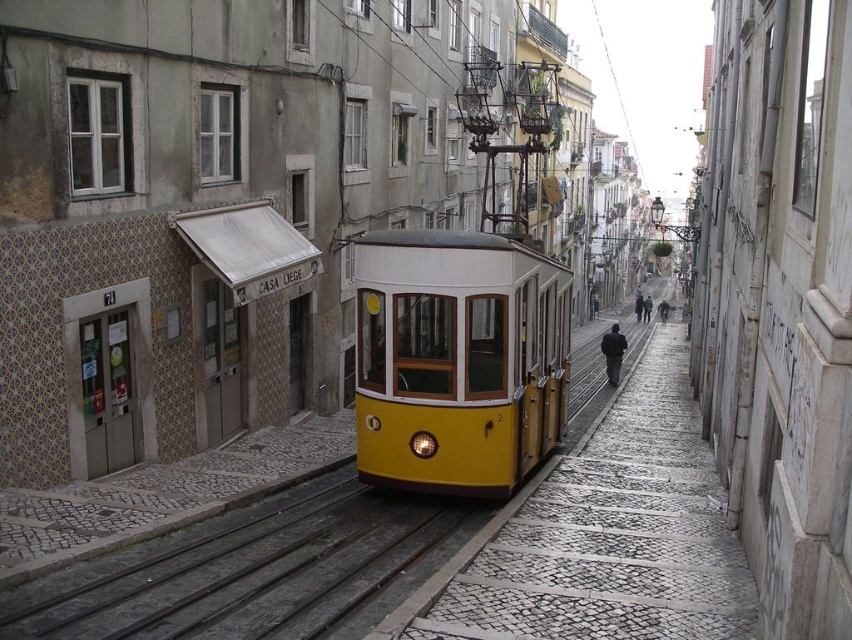
You are standing on the street and want to take a photo of the yellow matte cable car at center and the metallic gray train track at center. Which object should you focus on first to ensure both are in the frame?

You should focus on the yellow matte cable car at center first because it is closer to you than the metallic gray train track at center, so capturing it first ensures both will be in the frame.

You are a city planner assessing the feasibility of expanding the tram system. The yellow matte cable car at center and the metallic gray train track at center are key elements. Based on their current dimensions, can the tram continue moving forward on the track without any adjustments?

The yellow matte cable car at center might be wider than metallic gray train track at center, so there is a possibility that the tram cannot continue moving forward without adjustments to either the car or the track width to ensure proper alignment and fit.

You are a tourist standing at the bottom of the hill and want to take a photo of the yellow matte cable car at center. Where should you position yourself to capture the cable car in the frame?

To capture the yellow matte cable car at center in your photo, position yourself directly in front of the cable car at the coordinates specified by its position at point (458, 358).